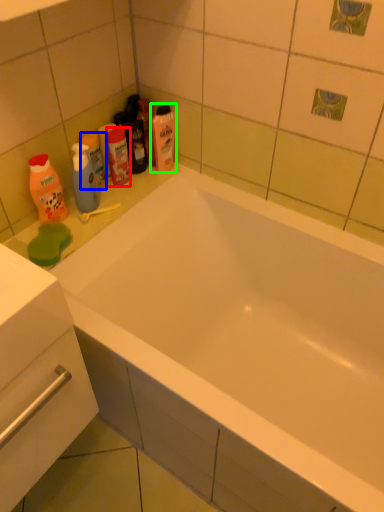
Question: Which object is the farthest from mouthwash (highlighted by a red box)? Choose among these: mouthwash (highlighted by a blue box) or cleaning product (highlighted by a green box).

Choices:
 (A) mouthwash
 (B) cleaning product

Answer: (B)